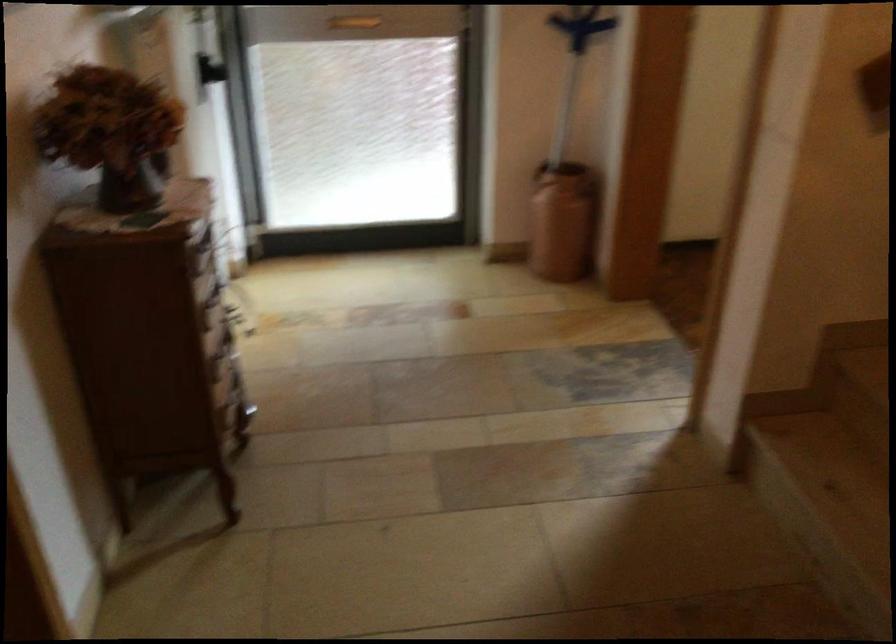
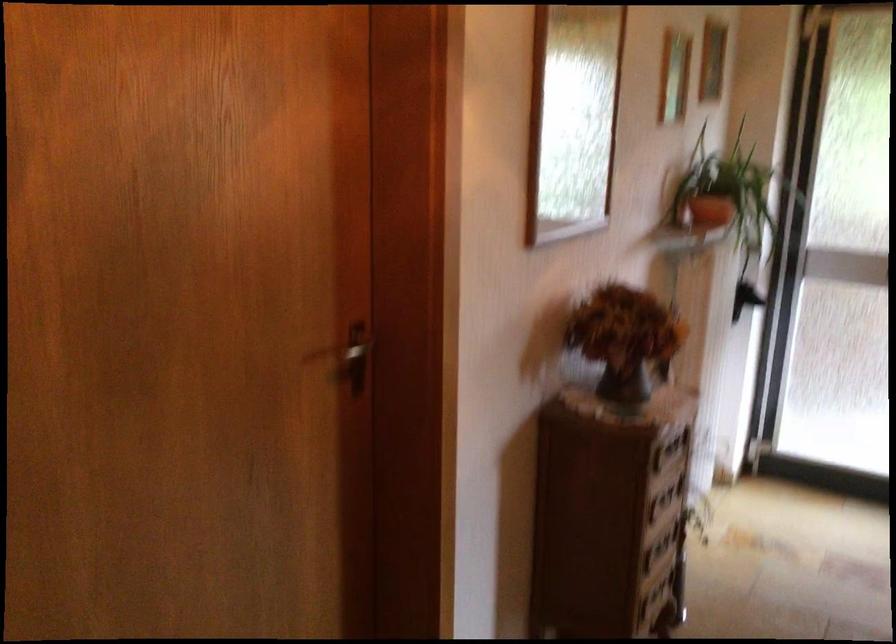
In the second image, find the point that corresponds to (x=119, y=131) in the first image.

(624, 339)